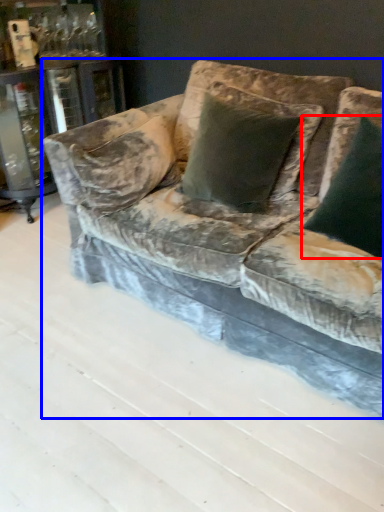
Question: Which object is further to the camera taking this photo, pillow (highlighted by a red box) or studio couch (highlighted by a blue box)?

Choices:
 (A) pillow
 (B) studio couch

Answer: (A)